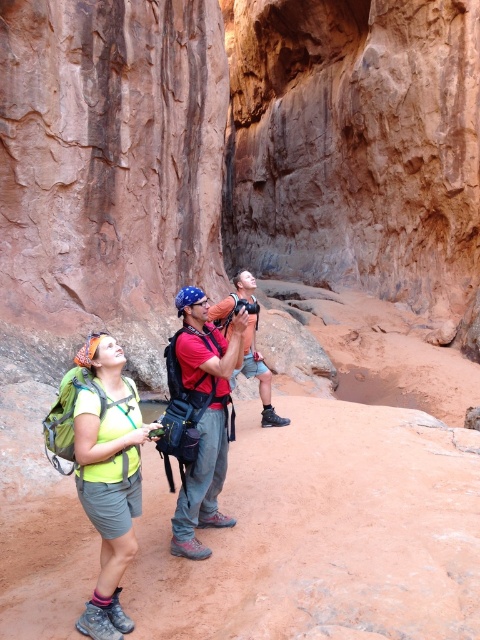
Question: Does matte red shirt at center appear on the right side of matte orange tank top at center?

Choices:
 (A) no
 (B) yes

Answer: (B)

Question: Which of the following is the farthest from the observer?

Choices:
 (A) matte orange tank top at center
 (B) neon green fabric backpack at lower left
 (C) matte red shirt at center

Answer: (A)

Question: Can you confirm if neon green fabric backpack at lower left is smaller than matte red shirt at center?

Choices:
 (A) no
 (B) yes

Answer: (B)

Question: Observing the image, what is the correct spatial positioning of neon green fabric backpack at lower left in reference to matte orange tank top at center?

Choices:
 (A) above
 (B) below

Answer: (B)

Question: Which object is the closest to the matte orange tank top at center?

Choices:
 (A) matte red shirt at center
 (B) neon green fabric backpack at lower left

Answer: (A)

Question: Which point is closer to the camera?

Choices:
 (A) (253, 369)
 (B) (224, 515)
 (C) (141, 483)

Answer: (C)